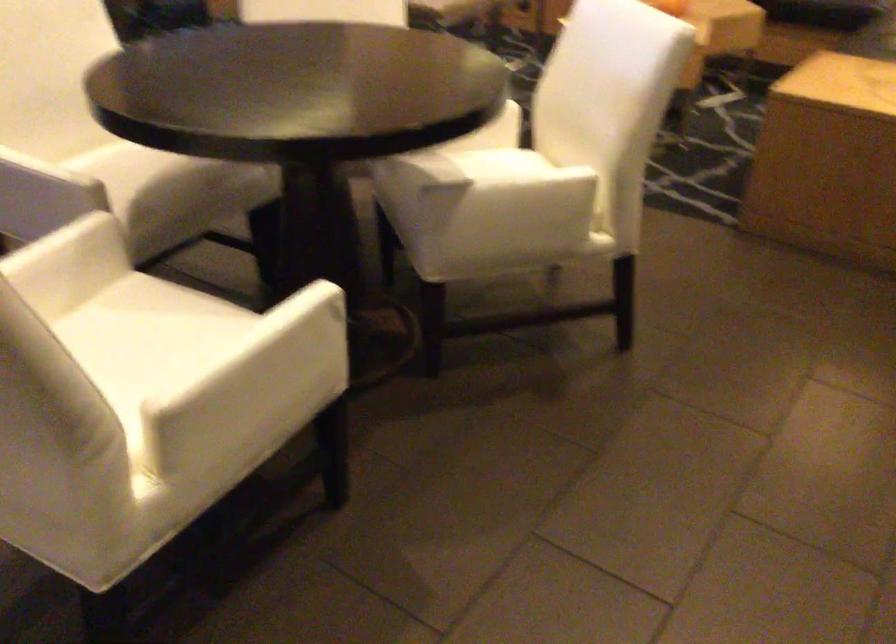
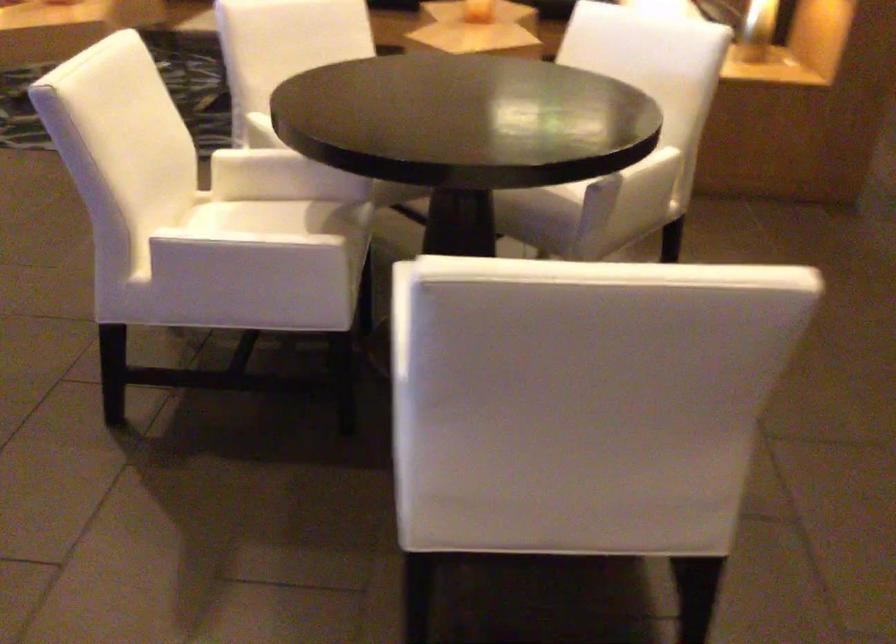
Question: What movement of the cameraman would produce the second image?

Choices:
 (A) Left
 (B) Right
 (C) Forward
 (D) Backward

Answer: (A)